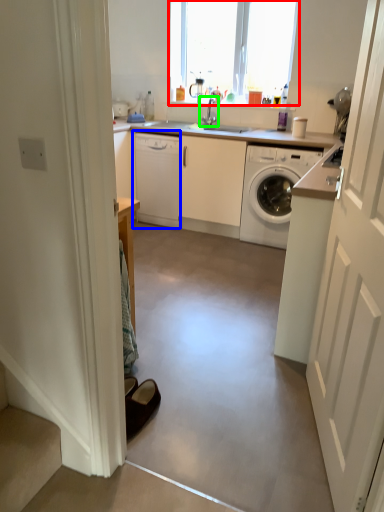
Question: Estimate the real-world distances between objects in this image. Which object is closer to window (highlighted by a red box), dish washer (highlighted by a blue box) or tap (highlighted by a green box)?

Choices:
 (A) dish washer
 (B) tap

Answer: (B)